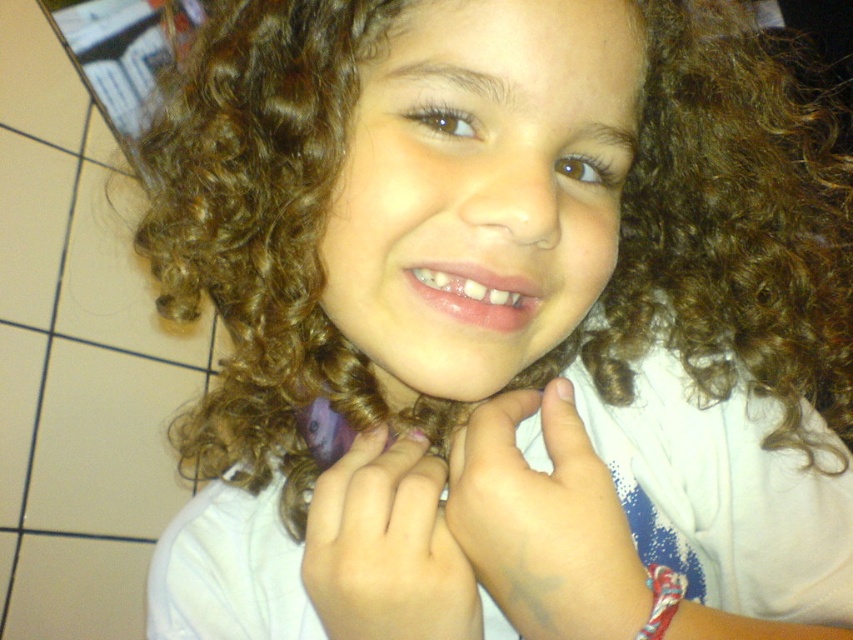
Can you confirm if white matte hand at center is smaller than smooth skin hand at center?

No.

Who is more distant from viewer, (519, 604) or (410, 556)?

The point (519, 604) is behind.

Is point (450, 481) positioned before point (408, 545)?

No, (450, 481) is further to viewer.

Where is `white matte hand at center`? The width and height of the screenshot is (853, 640). white matte hand at center is located at coordinates (544, 522).